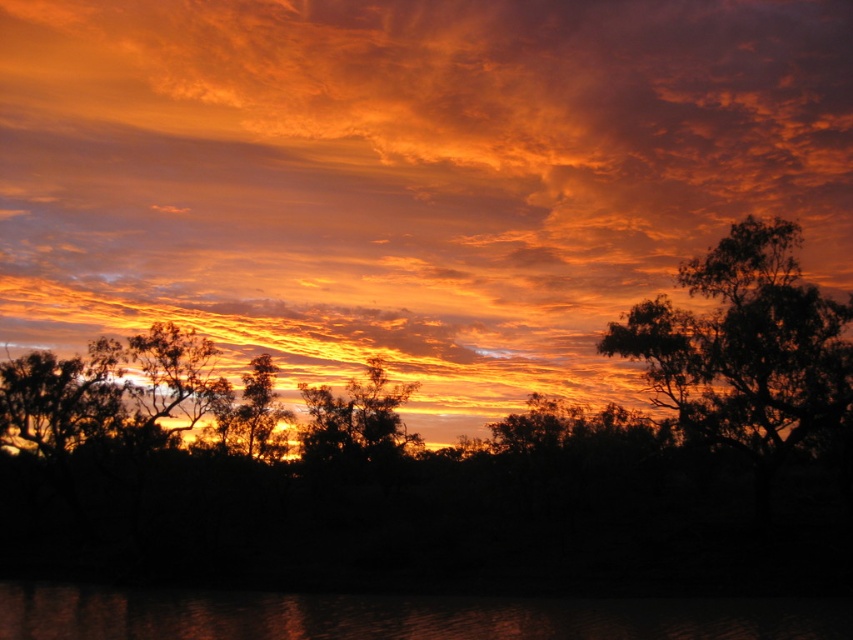
Question: Which object is positioned closest to the silky brown tree at center?

Choices:
 (A) dark green leafy tree at right
 (B) silhouette tree at center
 (C) glossy reflective water at lower center
 (D) orange matte cloud at upper center

Answer: (B)

Question: Estimate the real-world distances between objects in this image. Which object is closer to the glossy reflective water at lower center?

Choices:
 (A) silky brown tree at center
 (B) orange matte cloud at upper center
 (C) silhouette tree at center
 (D) dark green leafy tree at right

Answer: (D)

Question: Considering the relative positions of orange matte cloud at upper center and glossy reflective water at lower center in the image provided, where is orange matte cloud at upper center located with respect to glossy reflective water at lower center?

Choices:
 (A) right
 (B) left

Answer: (B)

Question: Does orange matte cloud at upper center have a greater width compared to silhouette tree at center?

Choices:
 (A) no
 (B) yes

Answer: (B)

Question: Which point is closer to the camera?

Choices:
 (A) (318, 438)
 (B) (357, 240)
 (C) (3, 593)
 (D) (811, 400)

Answer: (D)

Question: Does glossy reflective water at lower center come behind dark green leafy tree at right?

Choices:
 (A) no
 (B) yes

Answer: (A)